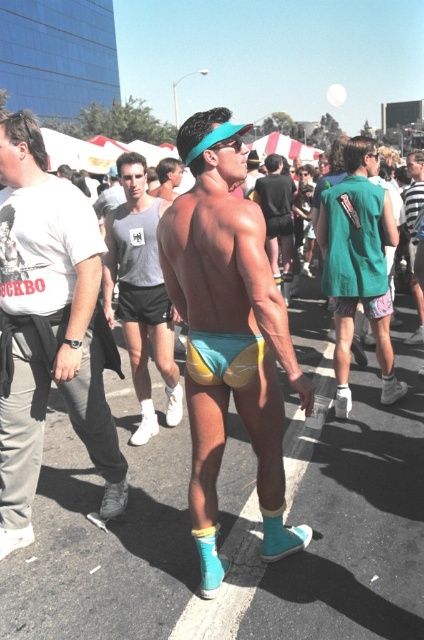
You are a photographer at the event and want to capture both the matte yellow and blue shorts at center and the yellow fabric shorts at center in the same frame. Which shorts should you focus on first to ensure both are in the shot?

The matte yellow and blue shorts at center should be focused on first since they are positioned on the left side of the yellow fabric shorts at center, allowing the photographer to frame both by starting from the left.

In the scene shown: You are a photographer at the event and want to capture both the matte yellow and blue shorts at center and the green fabric shorts at center in a single frame. Which pair of shorts will appear bigger in the photo?

The matte yellow and blue shorts at center will appear bigger in the photo because it is larger in size than the green fabric shorts at center.

You are a photographer at the event and want to capture a clear shot of both the matte yellow and blue shorts at center and the green fabric shorts at center. Which pair of shorts will appear larger in your photo?

The matte yellow and blue shorts at center will appear larger in the photo because they are closer to the viewer than the green fabric shorts at center.